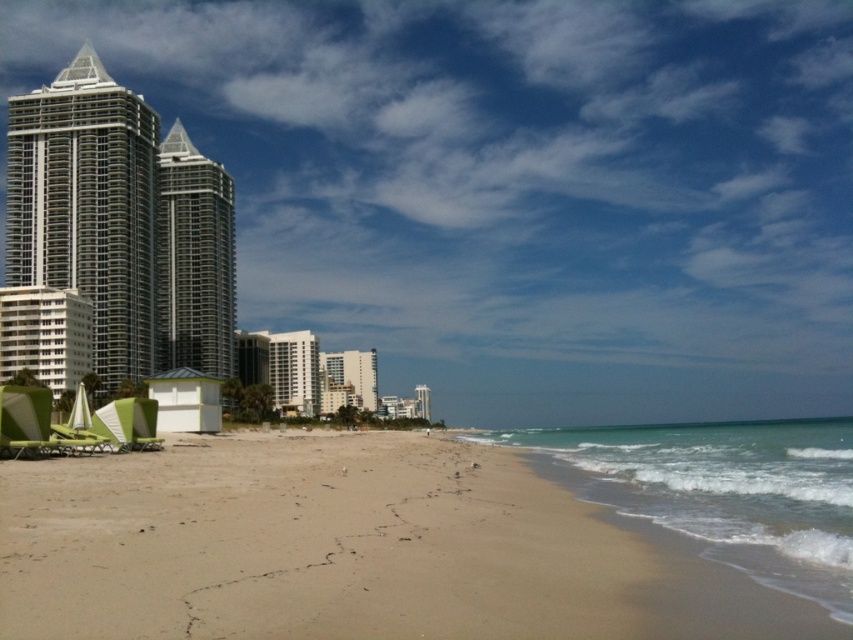
Question: Considering the relative positions of silver metallic building at center-left and white glossy building at center in the image provided, where is silver metallic building at center-left located with respect to white glossy building at center?

Choices:
 (A) below
 (B) above

Answer: (B)

Question: Among these objects, which one is nearest to the camera?

Choices:
 (A) light brown sand at lower center
 (B) white glossy building at center
 (C) silver metallic building at center-left
 (D) silver metallic building at upper left

Answer: (A)

Question: Does light brown sand at lower center have a greater width compared to silver metallic building at center-left?

Choices:
 (A) no
 (B) yes

Answer: (B)

Question: Which point is closer to the camera?

Choices:
 (A) silver metallic building at upper left
 (B) white glossy building at center
 (C) silver metallic building at center-left
 (D) light brown sand at lower center

Answer: (D)

Question: Considering the real-world distances, which object is farthest from the silver metallic building at center-left?

Choices:
 (A) white glossy building at center
 (B) silver metallic building at upper left

Answer: (A)

Question: Is silver metallic building at upper left thinner than white glossy building at center?

Choices:
 (A) no
 (B) yes

Answer: (A)